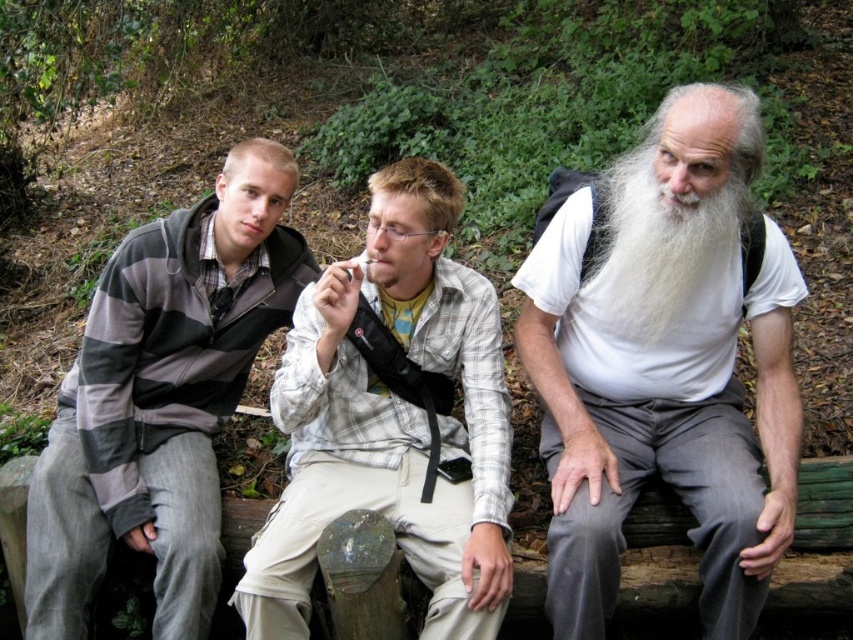
Question: Where is striped fleece jacket at left located in relation to white fluffy beard at right in the image?

Choices:
 (A) right
 (B) left

Answer: (B)

Question: Which object is positioned farthest from the white fluffy beard at right?

Choices:
 (A) light brown plaid shirt at center
 (B) striped fleece jacket at left
 (C) white matte beard at center

Answer: (B)

Question: Which of these objects is positioned closest to the striped fleece jacket at left?

Choices:
 (A) light brown plaid shirt at center
 (B) white matte beard at center
 (C) white fluffy beard at right

Answer: (A)

Question: Can you confirm if striped fleece jacket at left is positioned to the left of white fluffy beard at right?

Choices:
 (A) yes
 (B) no

Answer: (A)

Question: Is striped fleece jacket at left to the left of white fluffy beard at right from the viewer's perspective?

Choices:
 (A) no
 (B) yes

Answer: (B)

Question: Which object is the farthest from the striped fleece jacket at left?

Choices:
 (A) white fluffy beard at right
 (B) light brown plaid shirt at center
 (C) white matte beard at center

Answer: (A)